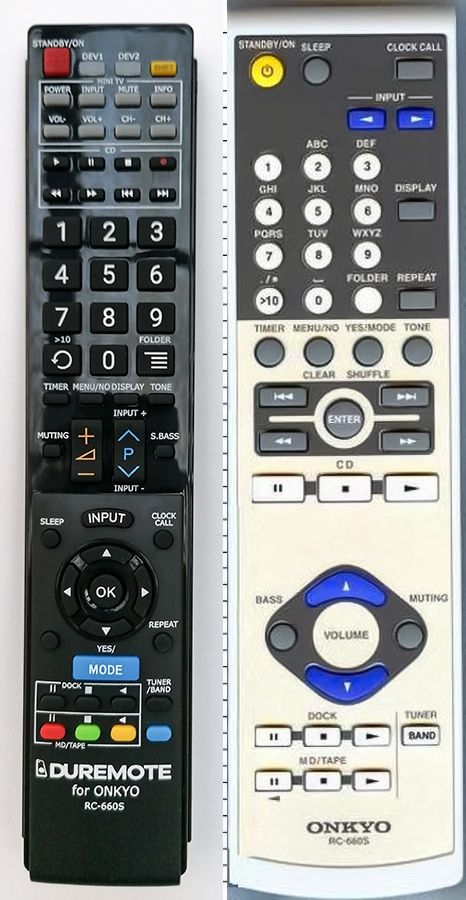
Identify the location of black remote control. (119, 844).